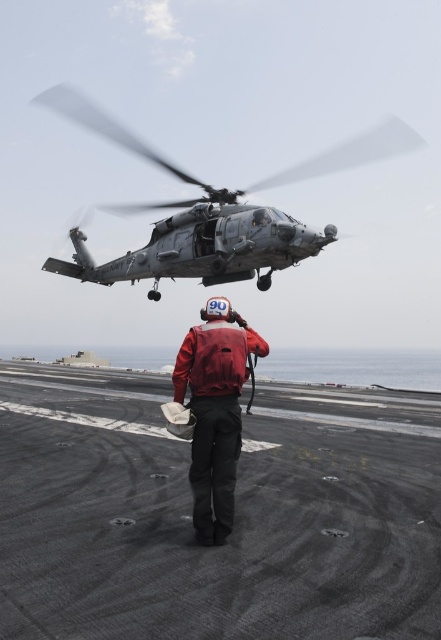
You are a photographer on the deck of an aircraft carrier. You need to capture a clear photo of both the red fabric jacket at center and the red matte jacket at center. Which jacket should you focus on first to ensure it appears larger in the photo?

The red fabric jacket at center is much taller than the red matte jacket at center, so you should focus on the red fabric jacket at center first to ensure it appears larger in the photo.

Based on the photo, you are a crew member on the aircraft carrier and need to determine if the dark gray metallic helicopter at upper center can fit through a narrow doorway that is just wide enough for the red fabric jacket at center. Based on their sizes, will the helicopter fit?

The dark gray metallic helicopter at upper center is wider than the red fabric jacket at center, so it will not fit through the doorway that is sized for the jacket.

You are standing on the deck of an aircraft carrier and need to move from point [190,269] to point [234,435]. Given that the helicopter is in motion, which direction should you move relative to the helicopter to reach your destination safely?

Point [190,269] is behind point [234,435]. Since the helicopter is moving, you should move forward towards the helicopter to reach point [234,435] safely.